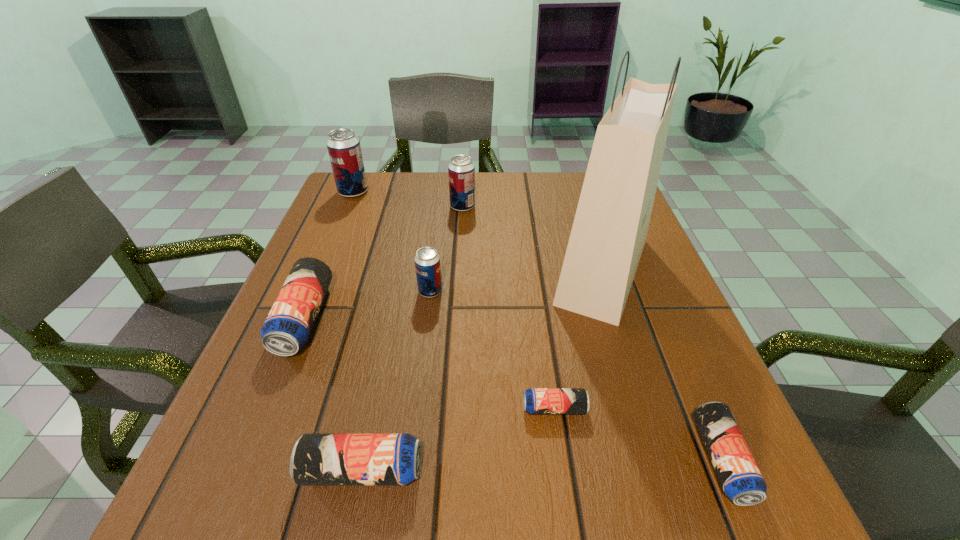
Where is `free point between the second blue beer can from left to right and the rightmost blue beer can`? The height and width of the screenshot is (540, 960). free point between the second blue beer can from left to right and the rightmost blue beer can is located at coordinates (541, 465).

Image resolution: width=960 pixels, height=540 pixels. What are the coordinates of `free space that is in between the rightmost blue beer can and the farthest blue beer can` in the screenshot? It's located at (513, 389).

Locate an element on the screen. Image resolution: width=960 pixels, height=540 pixels. free space between the second biggest red beer can and the second smallest blue beer can is located at coordinates (592, 333).

Find the location of `vacant area that lies between the sixth tallest object and the smallest red beer can`. vacant area that lies between the sixth tallest object and the smallest red beer can is located at coordinates click(396, 381).

What are the coordinates of `the second closest object to the farthest red beer can` in the screenshot? It's located at (287, 328).

Select which object is the closest to the farthest beer can. Please provide its 2D coordinates. Your answer should be formatted as a tuple, i.e. [(x, y)], where the tuple contains the x and y coordinates of a point satisfying the conditions above.

[(461, 170)]

Locate an element on the screen. Image resolution: width=960 pixels, height=540 pixels. beer can that is the sixth closest to the smallest blue beer can is located at coordinates (344, 149).

Choose which beer can is the nearest neighbor to the second blue beer can from right to left. Please provide its 2D coordinates. Your answer should be formatted as a tuple, i.e. [(x, y)], where the tuple contains the x and y coordinates of a point satisfying the conditions above.

[(741, 480)]

Choose which red beer can is the second nearest neighbor to the second biggest red beer can. Please provide its 2D coordinates. Your answer should be formatted as a tuple, i.e. [(x, y)], where the tuple contains the x and y coordinates of a point satisfying the conditions above.

[(427, 261)]

Choose which red beer can is the nearest neighbor to the rightmost blue beer can. Please provide its 2D coordinates. Your answer should be formatted as a tuple, i.e. [(x, y)], where the tuple contains the x and y coordinates of a point satisfying the conditions above.

[(427, 261)]